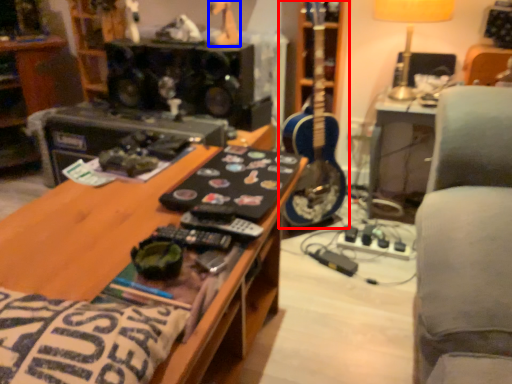
Question: Which point is further to the camera, guitar (highlighted by a red box) or toy (highlighted by a blue box)?

Choices:
 (A) guitar
 (B) toy

Answer: (A)